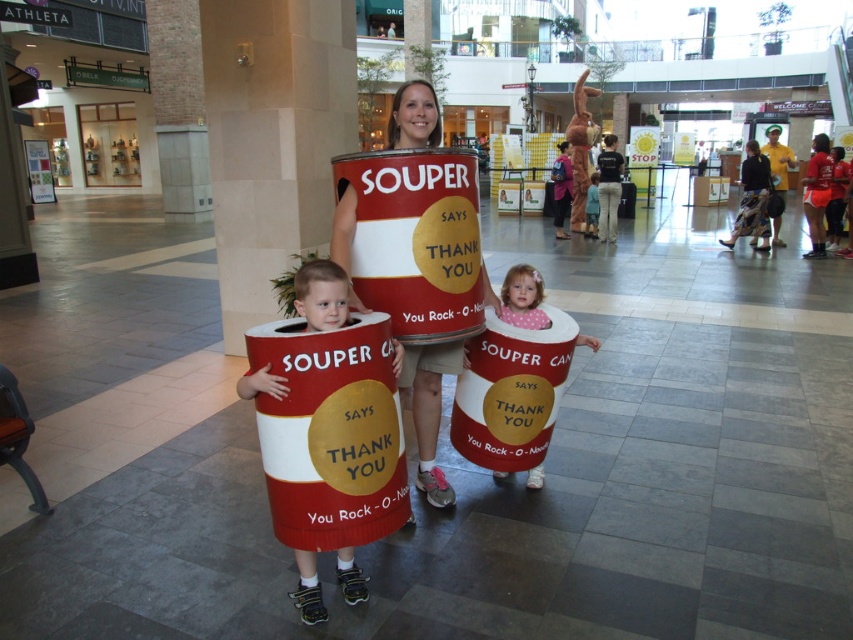
Does matte cardboard can at center appear over light blue fabric dress at center?

Incorrect, matte cardboard can at center is not positioned above light blue fabric dress at center.

Who is more distant from viewer, (396, 481) or (593, 172)?

Positioned behind is point (593, 172).

Where is `matte cardboard can at center`? matte cardboard can at center is located at coordinates (334, 448).

Which is more to the left, matte cardboard can at lower right or light blue fabric dress at center?

matte cardboard can at lower right

Is matte cardboard can at lower right thinner than light blue fabric dress at center?

No, matte cardboard can at lower right is not thinner than light blue fabric dress at center.

Which is behind, point (509, 278) or point (585, 202)?

The point (585, 202) is more distant.

Find the location of a particular element. The image size is (853, 640). matte cardboard can at lower right is located at coordinates (523, 298).

Between matte cardboard can at center and matte cardboard can at lower right, which one is positioned lower?

matte cardboard can at center is below.

Is point (386, 532) farther from camera compared to point (467, 358)?

That is False.

Who is more distant from viewer, (309, 609) or (508, 312)?

The point (508, 312) is behind.

Identify the location of matte cardboard can at center. (334, 448).